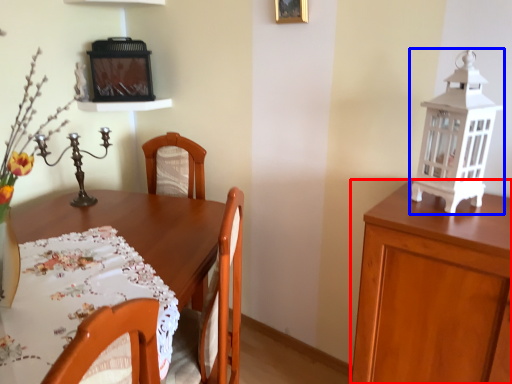
Question: Which point is further to the camera, cabinetry (highlighted by a red box) or lantern (highlighted by a blue box)?

Choices:
 (A) cabinetry
 (B) lantern

Answer: (B)